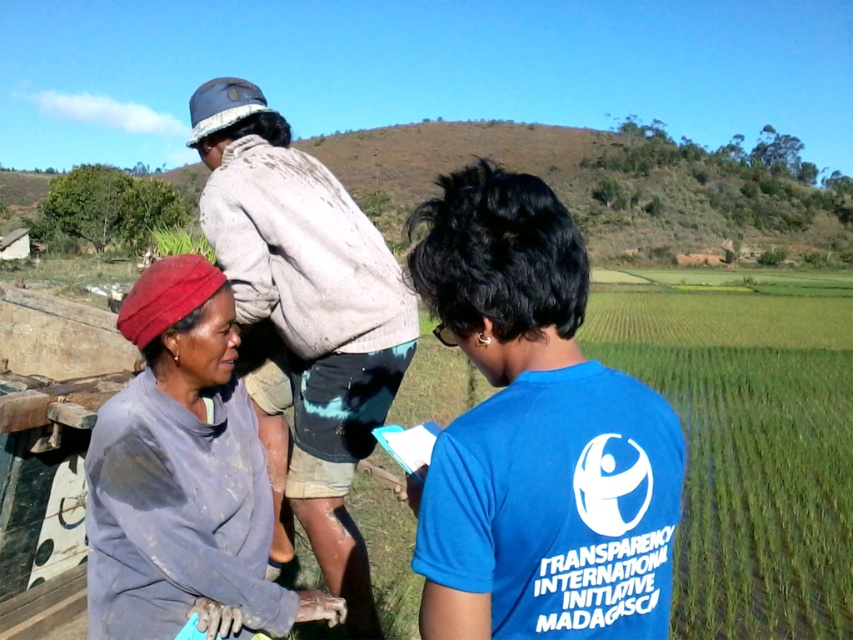
Is point (221, 154) more distant than point (230, 605)?

Yes, point (221, 154) is farther from viewer.

Between point (352, 285) and point (143, 492), which one is positioned in front?

Point (143, 492) is more forward.

The image size is (853, 640). In order to click on muddy gray shirt at upper center in this screenshot , I will do `click(305, 321)`.

Who is lower down, blue cotton shirt at center or muddy gray shirt at upper center?

blue cotton shirt at center is below.

Who is higher up, blue cotton shirt at center or muddy gray shirt at upper center?

muddy gray shirt at upper center is above.

The image size is (853, 640). In order to click on blue cotton shirt at center in this screenshot , I will do `click(537, 435)`.

Does blue cotton shirt at center appear on the left side of dirty gray fabric at lower left?

No, blue cotton shirt at center is not to the left of dirty gray fabric at lower left.

Can you confirm if blue cotton shirt at center is bigger than dirty gray fabric at lower left?

Incorrect, blue cotton shirt at center is not larger than dirty gray fabric at lower left.

Is point (459, 236) in front of point (259, 556)?

That is True.

Identify the location of blue cotton shirt at center. This screenshot has height=640, width=853. (537, 435).